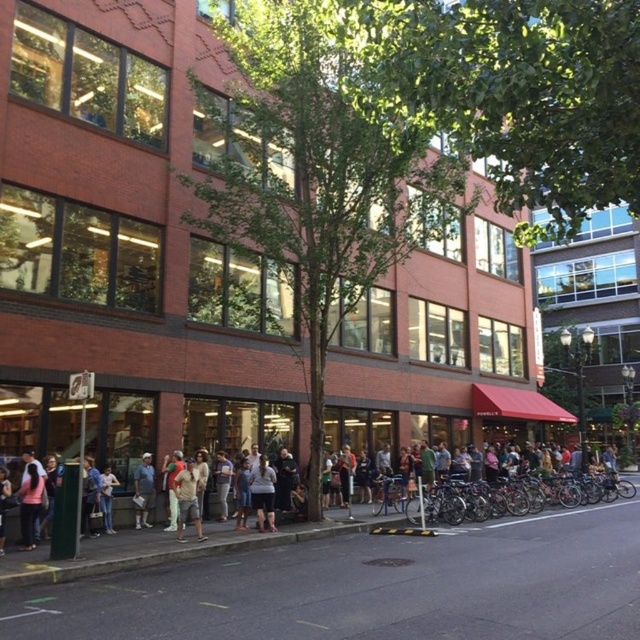
Who is lower down, light brown leather jacket at center or light brown cotton shirt at center?

light brown leather jacket at center is lower down.

Between light brown leather jacket at center and light brown cotton shirt at center, which one is positioned higher?

Positioned higher is light brown cotton shirt at center.

Find the location of `light brown leather jacket at center`. light brown leather jacket at center is located at coordinates (568, 497).

Find the location of a particular element. The width and height of the screenshot is (640, 640). light brown leather jacket at center is located at coordinates (568, 497).

Who is lower down, pink fabric shirt at lower left or dark gray fabric shirt at center?

dark gray fabric shirt at center is lower down.

Does pink fabric shirt at lower left appear over dark gray fabric shirt at center?

Correct, pink fabric shirt at lower left is located above dark gray fabric shirt at center.

Is point (38, 496) positioned behind point (256, 496)?

No.

At what (x,y) coordinates should I click in order to perform the action: click on pink fabric shirt at lower left. Please return your answer as a coordinate pair (x, y). The height and width of the screenshot is (640, 640). Looking at the image, I should click on (29, 500).

Based on the photo, is black asphalt pavement at lower center shorter than light brown leather jacket at center?

Yes.

Does black asphalt pavement at lower center have a lesser width compared to light brown leather jacket at center?

Indeed, black asphalt pavement at lower center has a lesser width compared to light brown leather jacket at center.

Who is more distant from viewer, [292,595] or [141,545]?

Positioned behind is point [141,545].

What are the coordinates of `black asphalt pavement at lower center` in the screenshot? It's located at (371, 588).